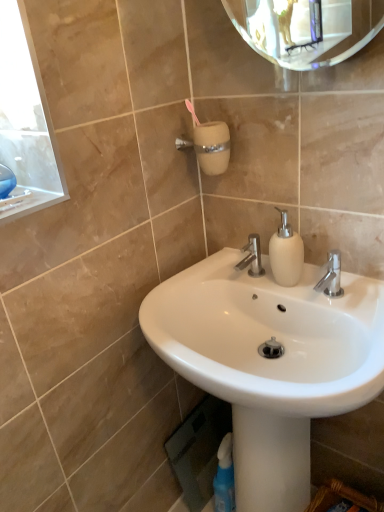
Locate an element on the screen. free region on the left part of polished chrome faucet at center is located at coordinates (205, 283).